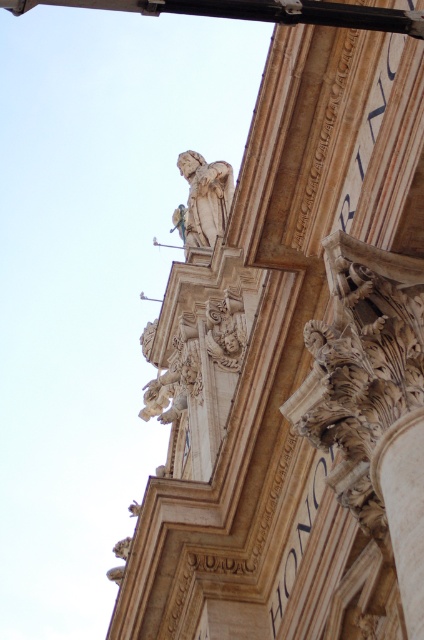
You are an architect examining the structure and need to determine which object is smaller between the white stone column at lower right and the black metal pole at upper center. Which one is smaller?

The white stone column at lower right has a smaller size compared to the black metal pole at upper center, so the white stone column at lower right is smaller.

You are an architect examining the facade of a historical building. You notice a black metal pole at upper center and a white marble statue at upper center. Which object is located to the right of the other?

The black metal pole at upper center is positioned on the right side of white marble statue at upper center.